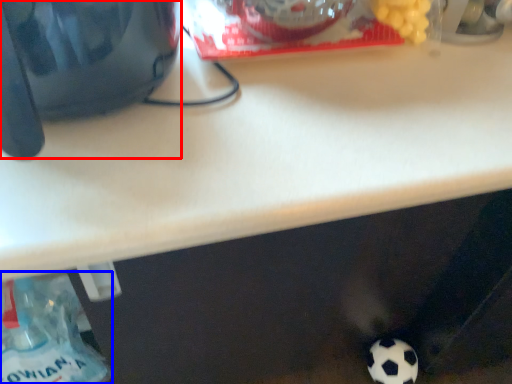
Question: Which of the following is the farthest to the observer, appliance (highlighted by a red box) or bottle (highlighted by a blue box)?

Choices:
 (A) appliance
 (B) bottle

Answer: (B)